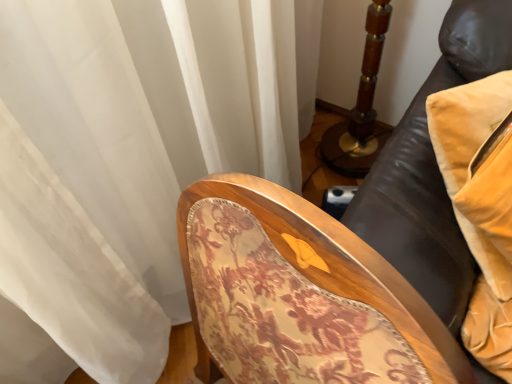
Question: Does velvet yellow pillow at right have a greater width compared to floral fabric chair at center?

Choices:
 (A) yes
 (B) no

Answer: (B)

Question: Is velvet yellow pillow at right at the left side of floral fabric chair at center?

Choices:
 (A) yes
 (B) no

Answer: (B)

Question: Is velvet yellow pillow at right bigger than floral fabric chair at center?

Choices:
 (A) no
 (B) yes

Answer: (A)

Question: Is velvet yellow pillow at right not within floral fabric chair at center?

Choices:
 (A) yes
 (B) no

Answer: (A)

Question: Is velvet yellow pillow at right taller than floral fabric chair at center?

Choices:
 (A) yes
 (B) no

Answer: (B)

Question: From the image's perspective, does velvet yellow pillow at right appear higher than floral fabric chair at center?

Choices:
 (A) no
 (B) yes

Answer: (B)

Question: From the image's perspective, is floral fabric chair at center located above velvet yellow pillow at right?

Choices:
 (A) no
 (B) yes

Answer: (A)

Question: From a real-world perspective, does floral fabric chair at center stand above velvet yellow pillow at right?

Choices:
 (A) no
 (B) yes

Answer: (A)

Question: From the image's perspective, is floral fabric chair at center under velvet yellow pillow at right?

Choices:
 (A) no
 (B) yes

Answer: (B)

Question: Considering the relative sizes of floral fabric chair at center and velvet yellow pillow at right in the image provided, is floral fabric chair at center thinner than velvet yellow pillow at right?

Choices:
 (A) yes
 (B) no

Answer: (B)

Question: Can you confirm if floral fabric chair at center is positioned to the left of velvet yellow pillow at right?

Choices:
 (A) no
 (B) yes

Answer: (B)

Question: Is floral fabric chair at center oriented away from velvet yellow pillow at right?

Choices:
 (A) yes
 (B) no

Answer: (A)

Question: In the image, is velvet yellow pillow at right positioned in front of or behind floral fabric chair at center?

Choices:
 (A) behind
 (B) front

Answer: (A)